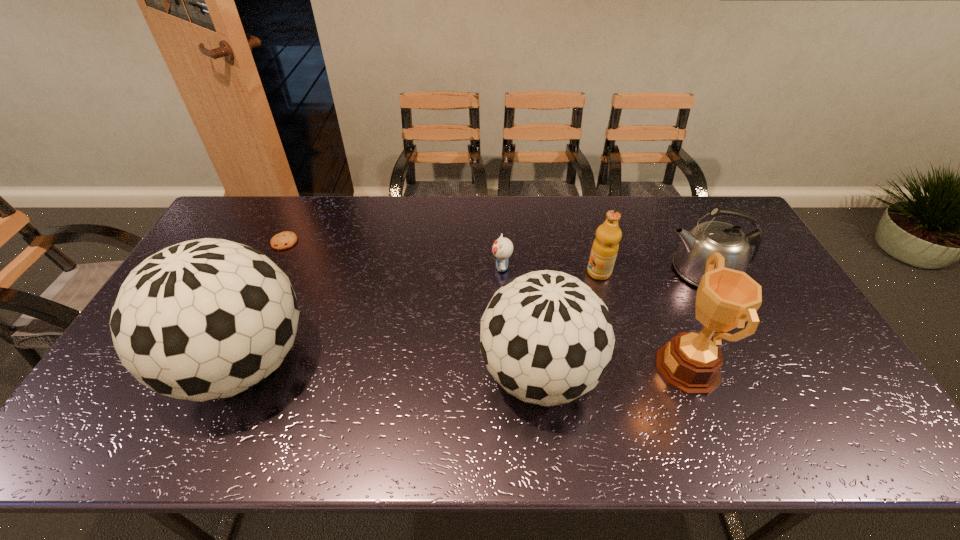
Where is `vacant area located 0.350m on the front-facing side of the award`? The image size is (960, 540). vacant area located 0.350m on the front-facing side of the award is located at coordinates (521, 368).

Where is `free space located on the front-facing side of the award`? Image resolution: width=960 pixels, height=540 pixels. free space located on the front-facing side of the award is located at coordinates (514, 368).

You are a GUI agent. You are given a task and a screenshot of the screen. Output one action in this format:
    pyautogui.click(x=<x>, y=<y>)
    Task: Click on the object positioned at the far edge
    The height and width of the screenshot is (540, 960).
    Given the screenshot: What is the action you would take?
    pyautogui.click(x=283, y=240)

This screenshot has height=540, width=960. I want to click on award at the near edge, so click(691, 362).

This screenshot has width=960, height=540. In order to click on object present at the left edge in this screenshot , I will do `click(205, 319)`.

I want to click on object located at the right edge, so click(x=739, y=250).

Where is `object located in the near left corner section of the desktop`? The height and width of the screenshot is (540, 960). object located in the near left corner section of the desktop is located at coordinates (205, 319).

In the image, there is a desktop. Where is `vacant space at the far edge`? vacant space at the far edge is located at coordinates (590, 214).

In order to click on vacant space at the near edge of the desktop in this screenshot , I will do `click(294, 398)`.

This screenshot has width=960, height=540. What are the coordinates of `vacant space at the right edge of the desktop` in the screenshot? It's located at click(x=757, y=256).